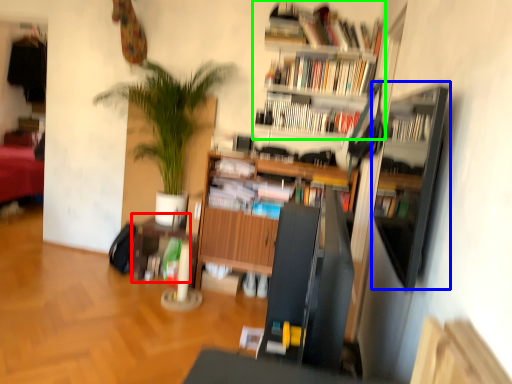
Question: Which object is positioned farthest from table (highlighted by a red box)? Select from shelf (highlighted by a blue box) and bookcase (highlighted by a green box).

Choices:
 (A) shelf
 (B) bookcase

Answer: (A)